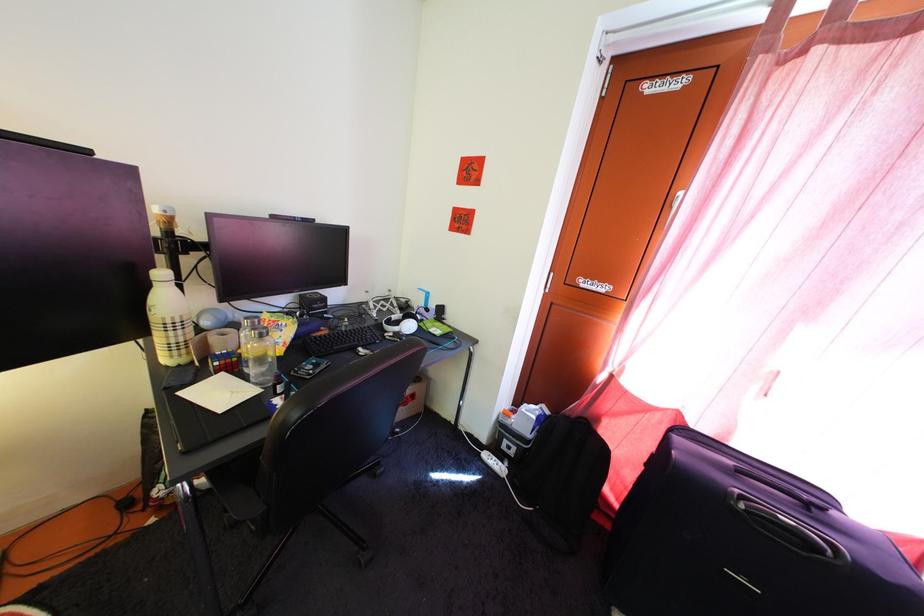
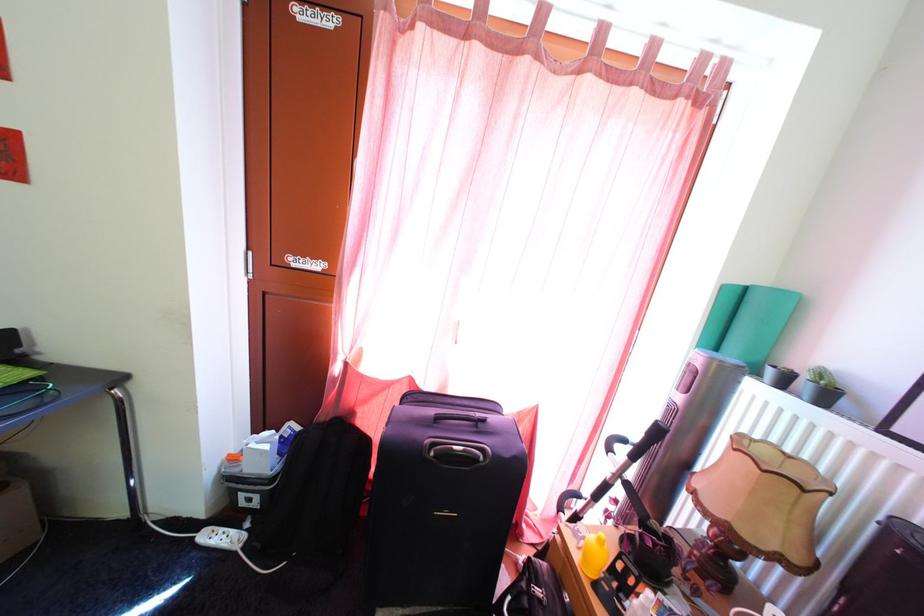
Locate, in the second image, the point that corresponds to the point at 492,456 in the first image.

(208, 533)